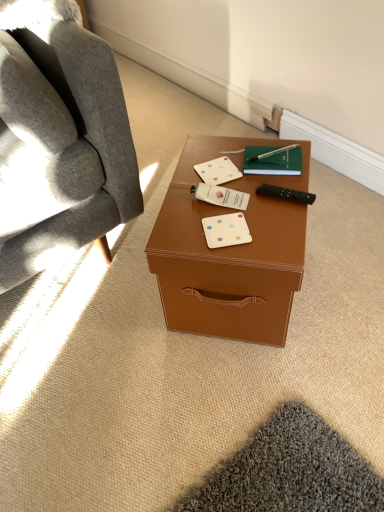
At what (x,y) coordinates should I click in order to perform the action: click on free point behind white matte business card at center, the second business card in the top-to-bottom sequence. Please return your answer as a coordinate pair (x, y). This screenshot has height=512, width=384. Looking at the image, I should click on (212, 157).